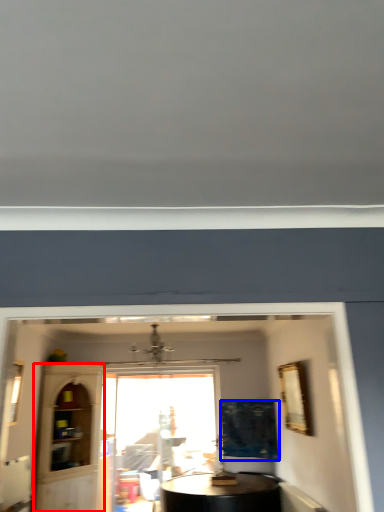
Question: Which of the following is the farthest to the observer, glass door (highlighted by a red box) or curtain (highlighted by a blue box)?

Choices:
 (A) glass door
 (B) curtain

Answer: (B)